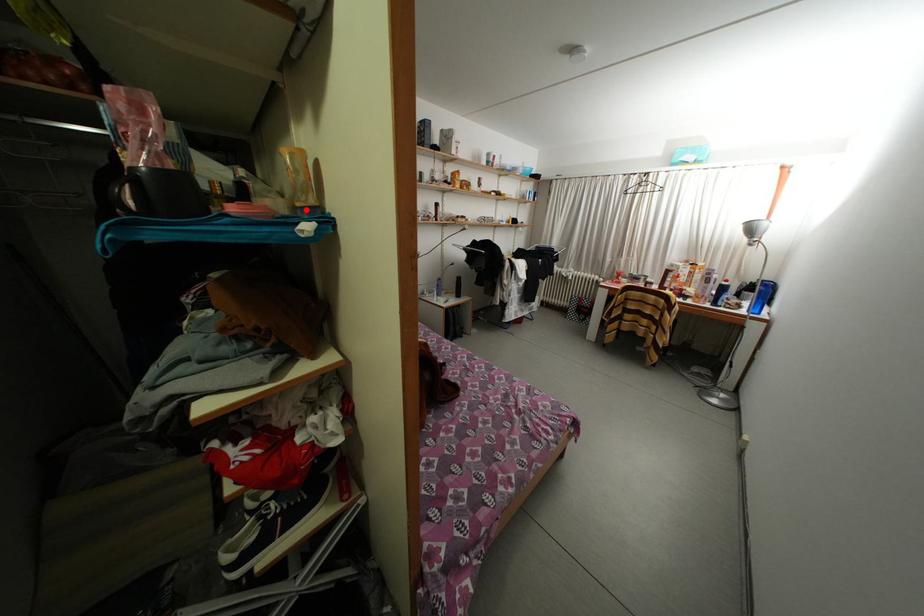
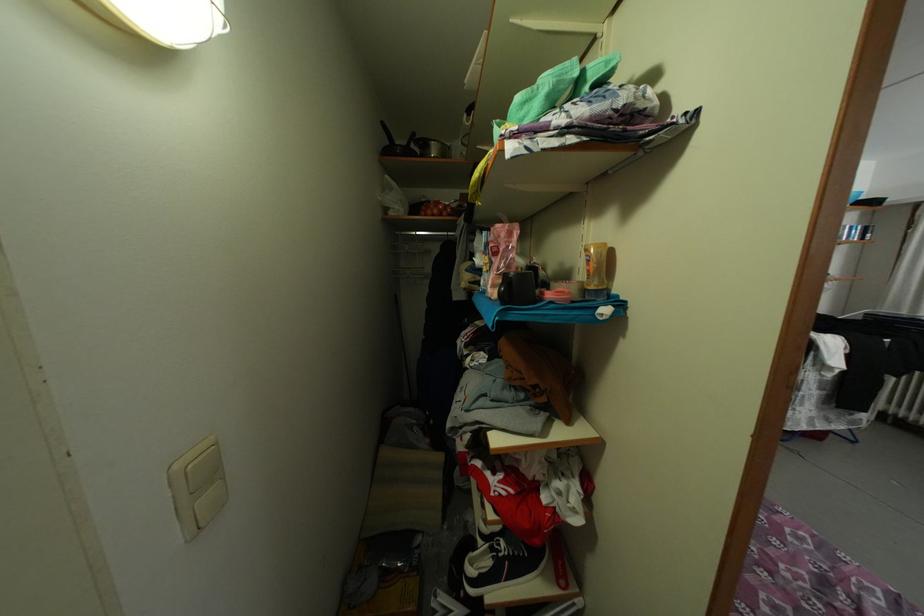
Where in the second image is the point corresponding to the highlighted location from the first image?

(598, 293)